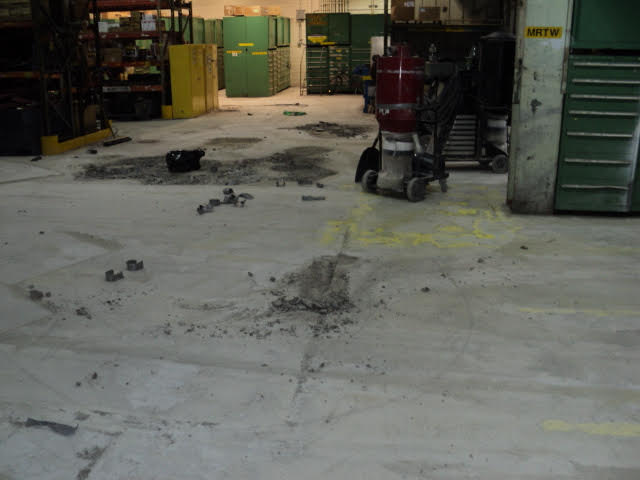
This screenshot has height=480, width=640. I want to click on electric box, so click(299, 15).